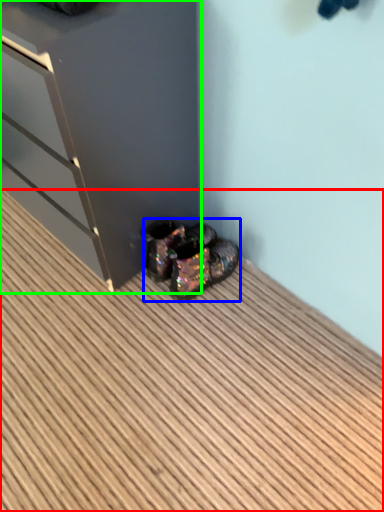
Question: Which object is the farthest from hardwood (highlighted by a red box)? Choose among these: footwear (highlighted by a blue box) or dresser (highlighted by a green box).

Choices:
 (A) footwear
 (B) dresser

Answer: (B)